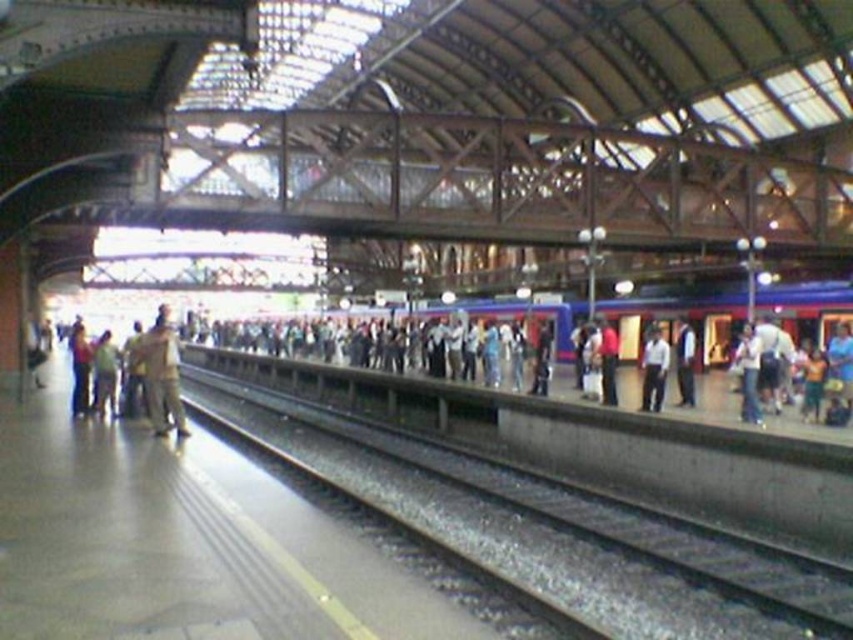
Does jeans at right have a smaller size compared to red shirt at right?

Yes, jeans at right is smaller than red shirt at right.

Does jeans at right lie in front of red shirt at right?

Yes, jeans at right is in front of red shirt at right.

Does point (744, 328) come behind point (606, 358)?

Yes, point (744, 328) is farther from viewer.

In order to click on jeans at right in this screenshot , I will do `click(747, 372)`.

Who is lower down, camouflage fabric jacket at center or red shirt at right?

red shirt at right is lower down.

Between point (137, 348) and point (606, 326), which one is positioned in front?

Point (137, 348) is more forward.

Find the location of `camouflage fabric jacket at center`. camouflage fabric jacket at center is located at coordinates (161, 374).

Which of these two, black metal train track at center or jeans at right, stands shorter?

With less height is black metal train track at center.

Between point (428, 483) and point (753, 384), which one is positioned behind?

Point (753, 384)

Who is more distant from viewer, [819,568] or [749,372]?

The point [749,372] is more distant.

Find the location of `black metal train track at center`. black metal train track at center is located at coordinates (527, 508).